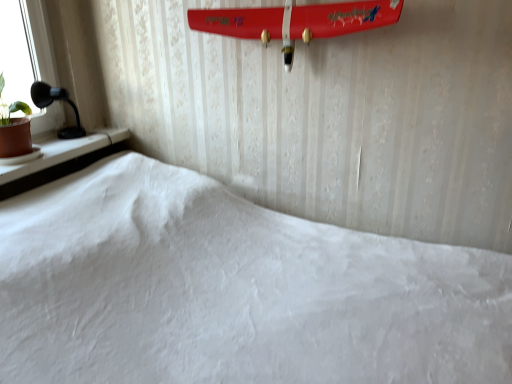
Question: From the image's perspective, is brown clay pot at left beneath black plastic table lamp at left?

Choices:
 (A) no
 (B) yes

Answer: (B)

Question: Is brown clay pot at left completely or partially outside of black plastic table lamp at left?

Choices:
 (A) yes
 (B) no

Answer: (A)

Question: From a real-world perspective, is brown clay pot at left under black plastic table lamp at left?

Choices:
 (A) no
 (B) yes

Answer: (A)

Question: Considering the relative sizes of brown clay pot at left and black plastic table lamp at left in the image provided, is brown clay pot at left thinner than black plastic table lamp at left?

Choices:
 (A) yes
 (B) no

Answer: (B)

Question: From a real-world perspective, is brown clay pot at left over black plastic table lamp at left?

Choices:
 (A) no
 (B) yes

Answer: (B)

Question: In the image, is black plastic table lamp at left on the left side or the right side of brown clay pot at left?

Choices:
 (A) left
 (B) right

Answer: (B)

Question: From a real-world perspective, is black plastic table lamp at left above or below brown clay pot at left?

Choices:
 (A) below
 (B) above

Answer: (A)

Question: In the image, is black plastic table lamp at left positioned in front of or behind brown clay pot at left?

Choices:
 (A) behind
 (B) front

Answer: (A)

Question: In terms of size, does black plastic table lamp at left appear bigger or smaller than brown clay pot at left?

Choices:
 (A) big
 (B) small

Answer: (B)

Question: Is shiny red surfboard at upper center to the left or to the right of black plastic table lamp at left in the image?

Choices:
 (A) left
 (B) right

Answer: (B)

Question: Is point (198, 23) positioned closer to the camera than point (45, 87)?

Choices:
 (A) closer
 (B) farther

Answer: (A)

Question: Which is correct: shiny red surfboard at upper center is inside black plastic table lamp at left, or outside of it?

Choices:
 (A) outside
 (B) inside

Answer: (A)

Question: Considering the positions of shiny red surfboard at upper center and black plastic table lamp at left in the image, is shiny red surfboard at upper center wider or thinner than black plastic table lamp at left?

Choices:
 (A) thin
 (B) wide

Answer: (B)

Question: Is point (10, 155) closer or farther from the camera than point (40, 82)?

Choices:
 (A) closer
 (B) farther

Answer: (A)

Question: From a real-world perspective, is brown clay pot at left physically located above or below black plastic table lamp at left?

Choices:
 (A) above
 (B) below

Answer: (A)